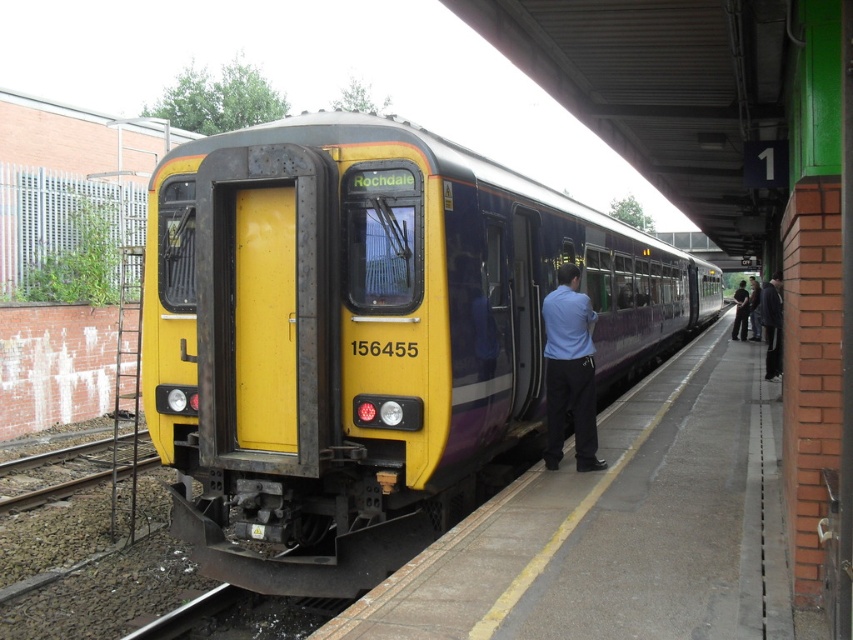
You are a passenger waiting at the train station. You see the concrete platform at center and the matte blue shirt at center. Which object takes up more space in the image?

The concrete platform at center is larger in size than the matte blue shirt at center, so the concrete platform at center takes up more space in the image.

You are a passenger waiting on the platform. You notice the concrete platform at center and the dark gray fabric jacket at right. Which object is closer to you?

The concrete platform at center is closer to you because it is shorter than the dark gray fabric jacket at right, meaning the jacket is further away from the platform and thus farther from your position on the platform.

You are a photographer trying to capture a clear photo of the Class 156 train at the station. You are standing on the platform near the yellow safety line and have your camera with you. Your dark blue jeans at right are currently positioned 13.27 meters away from the camera. Is this distance sufficient to ensure the entire train fits in your photo without cropping any parts?

The dark blue jeans at right and camera are 13.27 meters apart. This distance may be sufficient to capture the entire train in the photo, but it depends on the camera lens and sensor size. However, since the question only asks about distance, the 13.27 meters is the separation between you and the camera, not the train. The actual distance to the train isn